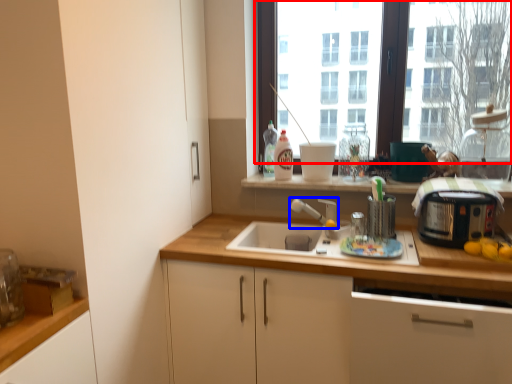
Question: Which object is closer to the camera taking this photo, window (highlighted by a red box) or faucet (highlighted by a blue box)?

Choices:
 (A) window
 (B) faucet

Answer: (B)